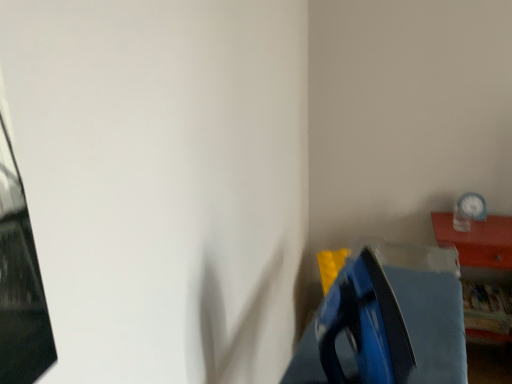
Question: From a real-world perspective, is wooden clock at upper right positioned above or below white plastic clock at upper right?

Choices:
 (A) above
 (B) below

Answer: (B)

Question: From their relative heights in the image, would you say wooden clock at upper right is taller or shorter than white plastic clock at upper right?

Choices:
 (A) tall
 (B) short

Answer: (A)

Question: Considering the positions of point (502, 294) and point (475, 193), is point (502, 294) closer or farther from the camera than point (475, 193)?

Choices:
 (A) closer
 (B) farther

Answer: (A)

Question: Is point (465, 195) closer or farther from the camera than point (440, 243)?

Choices:
 (A) closer
 (B) farther

Answer: (B)

Question: Is white plastic clock at upper right spatially inside wooden clock at upper right, or outside of it?

Choices:
 (A) inside
 (B) outside

Answer: (B)

Question: Is white plastic clock at upper right taller or shorter than wooden clock at upper right?

Choices:
 (A) short
 (B) tall

Answer: (A)

Question: Is white plastic clock at upper right in front of or behind wooden clock at upper right in the image?

Choices:
 (A) behind
 (B) front

Answer: (A)